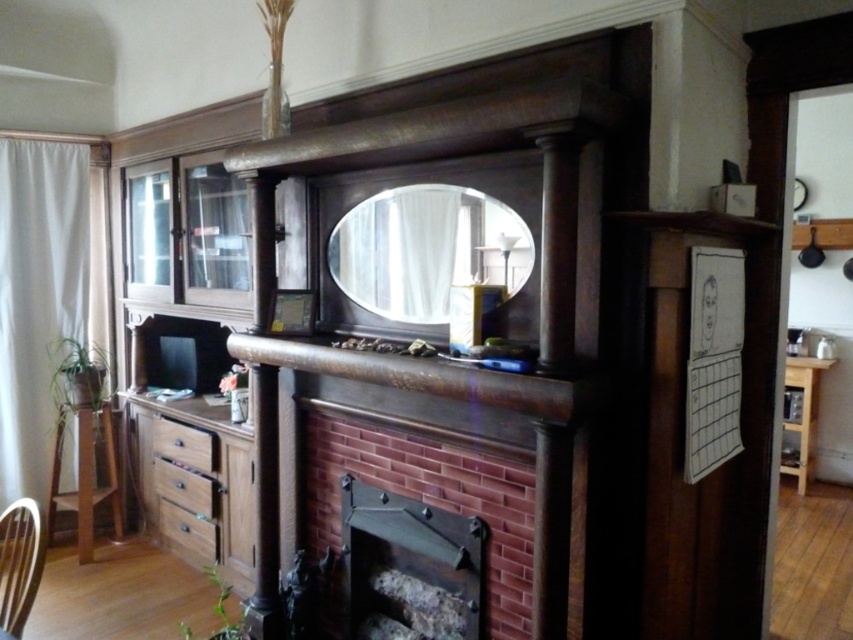
You are an interior designer planning to place a 1.2 meter wide decorative shelf between the clear glass mirror at center and the brown wood drawer at lower left. Will there be enough space for it?

The clear glass mirror at center and the brown wood drawer at lower left are 1.50 meters apart. Since the shelf is 1.2 meters wide, there is enough space to place it between them.

You are an interior designer planning to place a new decorative item on the mantel. You have two options, the clear glass mirror at center and the brown wood drawer at lower left. Which object should you choose if you want to place a larger item on the mantel?

The clear glass mirror at center is larger in size than the brown wood drawer at lower left, so you should choose the clear glass mirror at center for placing a larger item on the mantel.